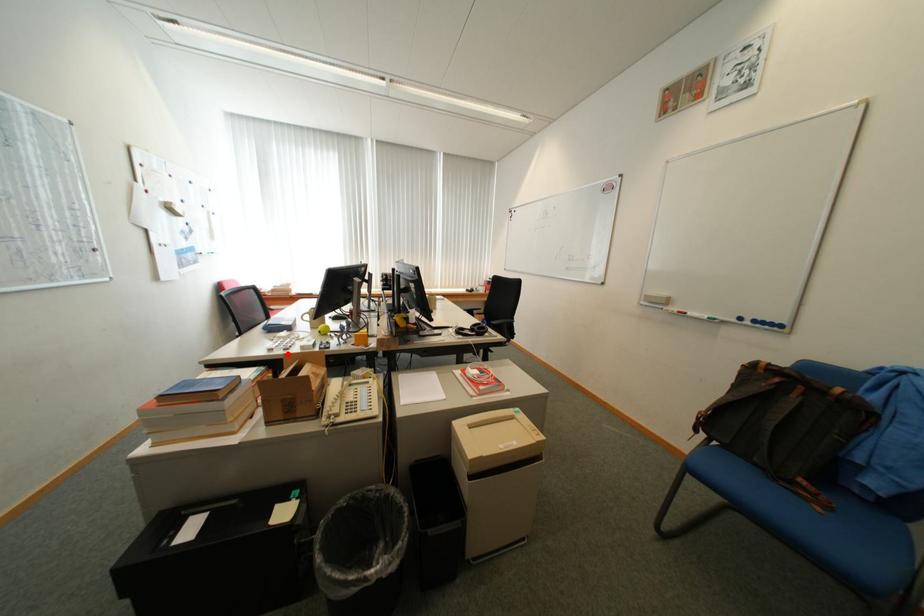
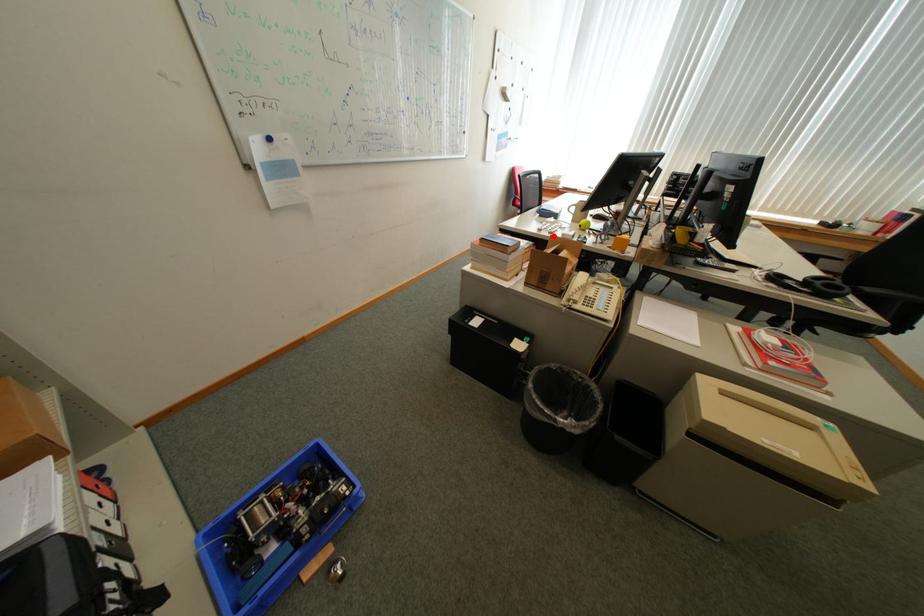
I am providing you with two images of the same scene from different viewpoints. A red point is marked on the first image and another point is marked on the second image. Do the highlighted points in image1 and image2 indicate the same real-world spot?

Yes